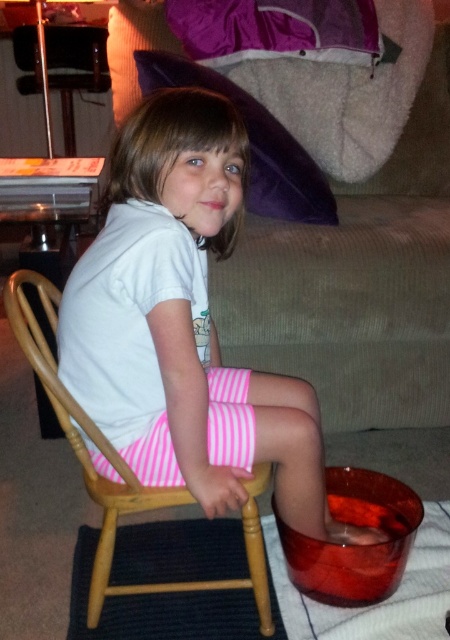
Question: Based on their relative distances, which object is farther from the beige corduroy couch at center?

Choices:
 (A) white cotton shirt at center
 (B) pink striped shorts at center
 (C) wooden rocking chair at center

Answer: (C)

Question: Which object appears farthest from the camera in this image?

Choices:
 (A) pink striped shorts at center
 (B) white cotton shirt at center
 (C) wooden rocking chair at center

Answer: (A)

Question: In this image, where is wooden rocking chair at center located relative to pink striped shorts at center?

Choices:
 (A) right
 (B) left

Answer: (B)

Question: Estimate the real-world distances between objects in this image. Which object is closer to the white cotton shirt at center?

Choices:
 (A) wooden rocking chair at center
 (B) pink striped shorts at center

Answer: (B)

Question: Does white cotton shirt at center lie in front of beige corduroy couch at center?

Choices:
 (A) no
 (B) yes

Answer: (B)

Question: Considering the relative positions of white cotton shirt at center and beige corduroy couch at center in the image provided, where is white cotton shirt at center located with respect to beige corduroy couch at center?

Choices:
 (A) right
 (B) left

Answer: (B)